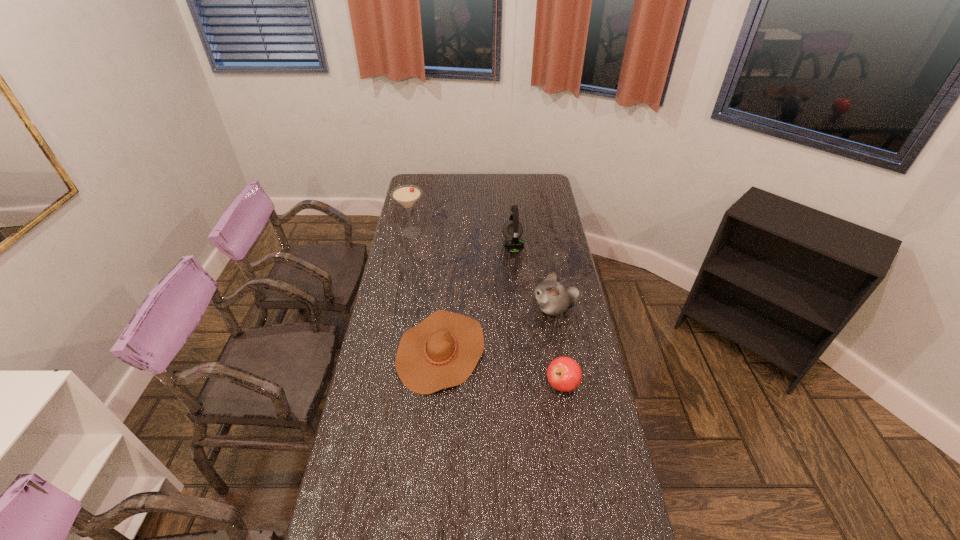
I want to click on martini, so click(406, 195).

At what (x,y) coordinates should I click in order to perform the action: click on the third object from left to right. Please return your answer as a coordinate pair (x, y). Image resolution: width=960 pixels, height=540 pixels. Looking at the image, I should click on (512, 230).

Where is `the third tallest object`? the third tallest object is located at coordinates (553, 298).

You are a GUI agent. You are given a task and a screenshot of the screen. Output one action in this format:
    pyautogui.click(x=<x>, y=<y>)
    Task: Click on the fourth tallest object
    Image resolution: width=960 pixels, height=540 pixels.
    Given the screenshot: What is the action you would take?
    pyautogui.click(x=564, y=374)

Locate an element on the screen. This screenshot has height=540, width=960. cowboy hat is located at coordinates (442, 351).

Where is `vacant space located on the right of the martini`? vacant space located on the right of the martini is located at coordinates (499, 233).

This screenshot has height=540, width=960. I want to click on vacant space located on the ear cups of the headset, so click(x=490, y=245).

Identify the location of blank space located on the ear cups of the headset. (457, 245).

I want to click on vacant space located 0.080m on the ear cups of the headset, so click(x=485, y=245).

The image size is (960, 540). I want to click on free region located 0.050m on the face of the third tallest object, so click(518, 308).